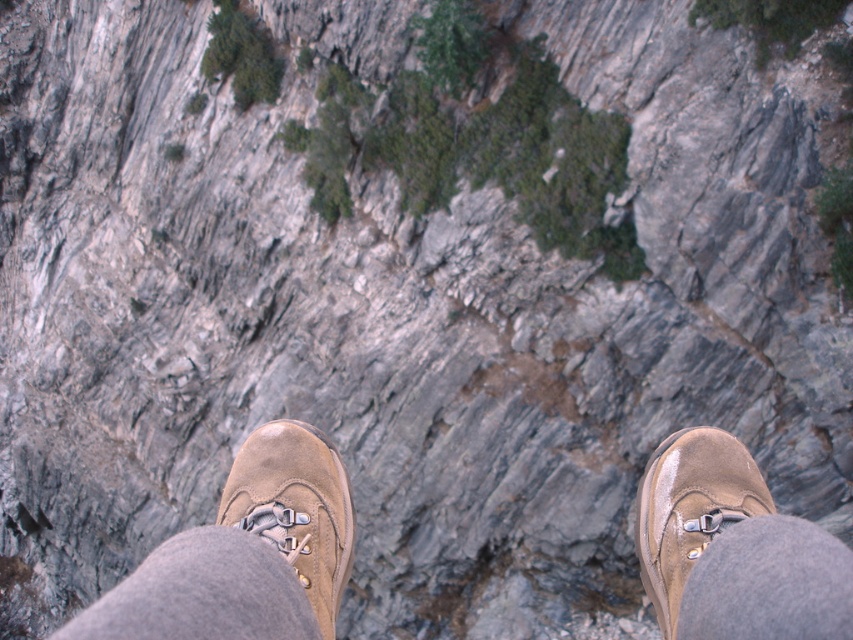
Is the position of brown suede shoes at center less distant than that of brown suede shoe at lower right?

Yes, it is.

Which is above, brown suede shoes at center or brown suede shoe at lower right?

brown suede shoe at lower right is above.

Image resolution: width=853 pixels, height=640 pixels. I want to click on brown suede shoes at center, so click(247, 554).

Where is `brown suede shoes at center`? The width and height of the screenshot is (853, 640). brown suede shoes at center is located at coordinates (247, 554).

Is brown suede shoe at center to the left of brown suede shoe at lower right from the viewer's perspective?

Indeed, brown suede shoe at center is positioned on the left side of brown suede shoe at lower right.

Between brown suede shoe at center and brown suede shoe at lower right, which one is positioned higher?

brown suede shoe at center is above.

This screenshot has width=853, height=640. What do you see at coordinates (294, 508) in the screenshot?
I see `brown suede shoe at center` at bounding box center [294, 508].

The width and height of the screenshot is (853, 640). What are the coordinates of `brown suede shoe at center` in the screenshot? It's located at click(294, 508).

Which is more to the right, brown suede shoes at center or brown suede shoe at center?

brown suede shoes at center is more to the right.

Does point (338, 557) lie behind point (236, 481)?

No, (338, 557) is in front of (236, 481).

Does point (335, 508) lie in front of point (311, 550)?

No, it is behind (311, 550).

You are a GUI agent. You are given a task and a screenshot of the screen. Output one action in this format:
    pyautogui.click(x=<x>, y=<y>)
    Task: Click on the brown suede shoes at center
    
    Given the screenshot: What is the action you would take?
    pyautogui.click(x=247, y=554)